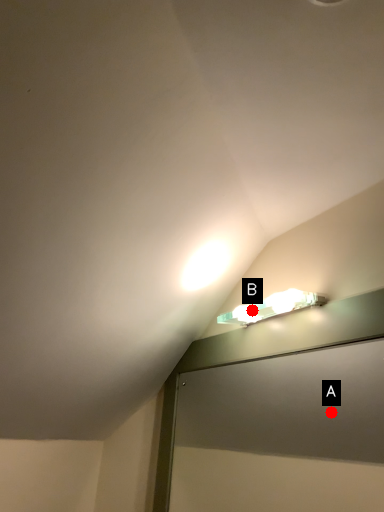
Question: Two points are circled on the image, labeled by A and B beside each circle. Which point is closer to the camera?

Choices:
 (A) A is closer
 (B) B is closer

Answer: (B)